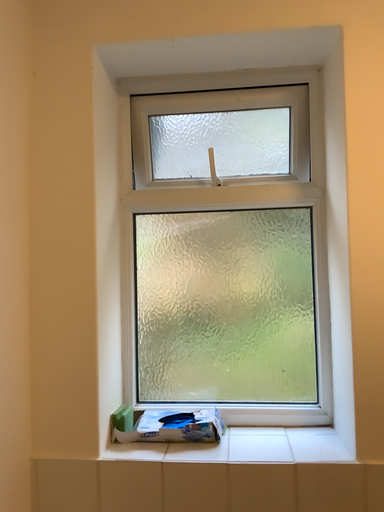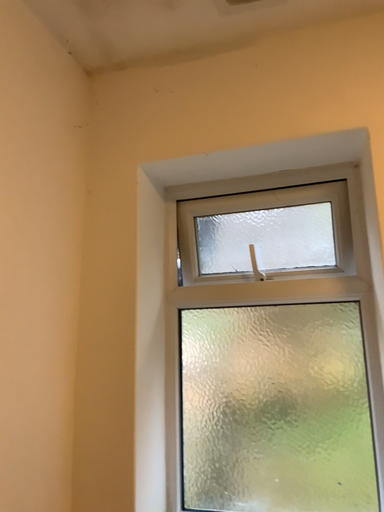
Question: How did the camera likely rotate when shooting the video?

Choices:
 (A) rotated left
 (B) rotated right

Answer: (A)